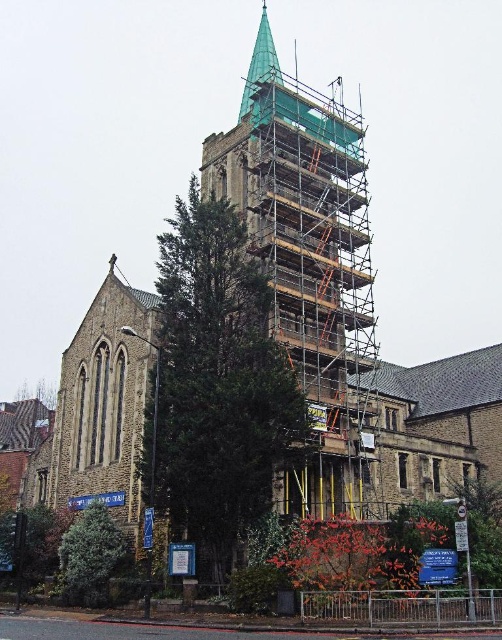
You are standing in front of the church and want to take a photo of the steeple without the green metal scaffolding at center blocking the view. Based on the coordinates provided, where should you position yourself to capture the steeple clearly?

To avoid the green metal scaffolding at center located at coordinates point (309,266), you should position yourself to the left or right of the scaffolding to ensure the steeple is visible without obstruction.

You are a construction worker standing at the base of the green metal scaffolding at center. You need to move to the green textured tree at lower left to secure some loose branches. Which direction should you walk to reach the tree?

You should walk to the left to reach the green textured tree at lower left because the green metal scaffolding at center is to the right of the tree.